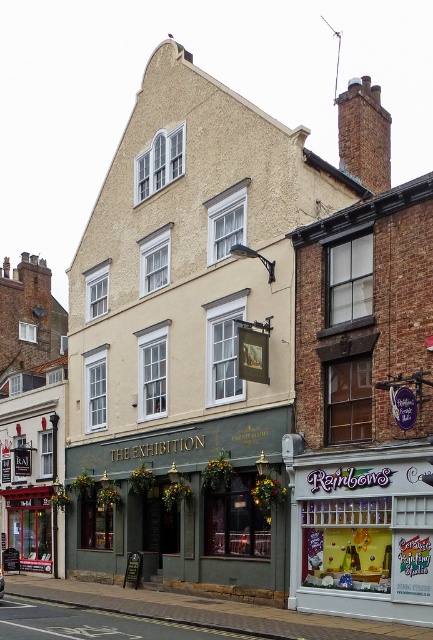
Question: Does green matte pub at center appear over white frosted glass at lower right?

Choices:
 (A) yes
 (B) no

Answer: (B)

Question: Does green matte pub at center have a lesser width compared to metallic silver car at center?

Choices:
 (A) yes
 (B) no

Answer: (B)

Question: Which of the following is the closest to the observer?

Choices:
 (A) (2, 582)
 (B) (219, 541)

Answer: (A)

Question: Estimate the real-world distances between objects in this image. Which object is farther from the metallic silver car at center?

Choices:
 (A) white frosted glass at lower right
 (B) green matte pub at center

Answer: (A)

Question: Where is white frosted glass at lower right located in relation to metallic silver car at center in the image?

Choices:
 (A) above
 (B) below

Answer: (A)

Question: Which of the following is the farthest from the observer?

Choices:
 (A) (0, 593)
 (B) (175, 547)

Answer: (B)